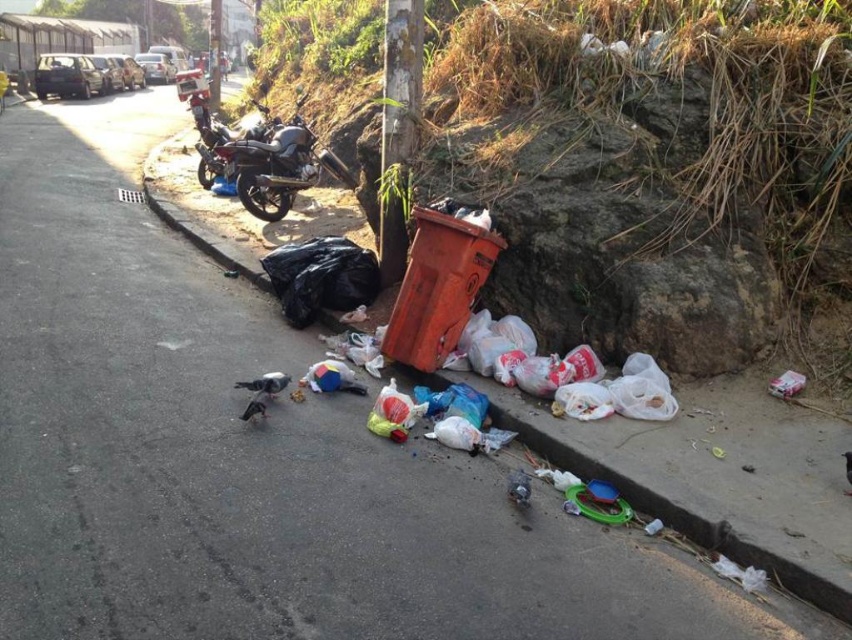
The width and height of the screenshot is (852, 640). What do you see at coordinates (281, 166) in the screenshot?
I see `shiny black motorcycle at center` at bounding box center [281, 166].

Can you confirm if shiny black motorcycle at center is positioned to the right of black plastic bag at lower left?

No, shiny black motorcycle at center is not to the right of black plastic bag at lower left.

Locate an element on the screen. The image size is (852, 640). shiny black motorcycle at center is located at coordinates (281, 166).

Who is higher up, orange plastic bin at lower right or shiny black motorcycle at center?

shiny black motorcycle at center is higher up.

Based on the photo, is orange plastic bin at lower right further to camera compared to shiny black motorcycle at center?

No, it is in front of shiny black motorcycle at center.

Which is in front, point (692, 332) or point (300, 140)?

Point (692, 332)

Locate an element on the screen. This screenshot has width=852, height=640. orange plastic bin at lower right is located at coordinates (653, 170).

From the picture: Can you confirm if orange plastic bin at lower right is smaller than black plastic bag at lower left?

Yes, orange plastic bin at lower right is smaller than black plastic bag at lower left.

Does orange plastic bin at lower right have a lesser width compared to black plastic bag at lower left?

Yes.

Find the location of a particular element. orange plastic bin at lower right is located at coordinates (653, 170).

The width and height of the screenshot is (852, 640). In order to click on orange plastic bin at lower right in this screenshot , I will do `click(653, 170)`.